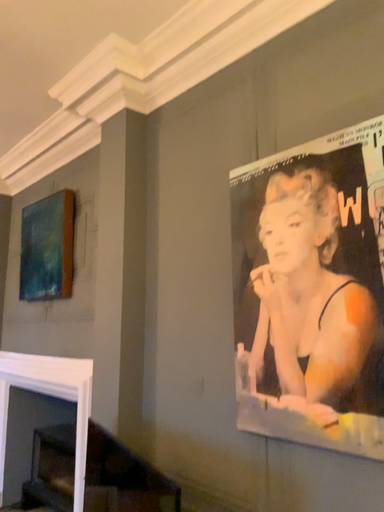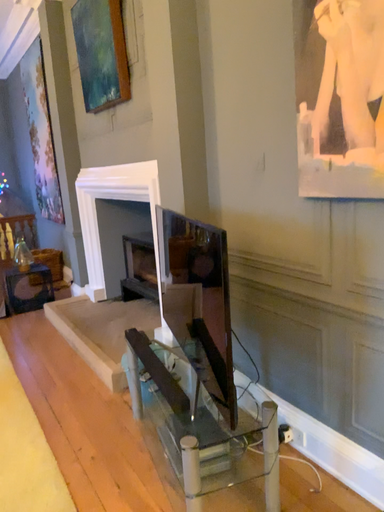
Question: How did the camera likely rotate when shooting the video?

Choices:
 (A) rotated upward
 (B) rotated downward

Answer: (B)